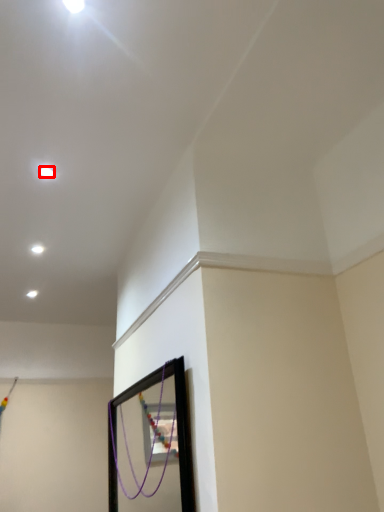
Question: From the image's perspective, considering the relative positions of light (annotated by the red box) and light in the image provided, where is light (annotated by the red box) located with respect to the staircase?

Choices:
 (A) above
 (B) below

Answer: (A)